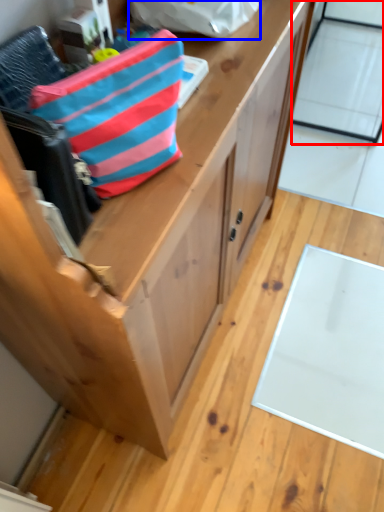
Question: Which point is closer to the camera, glass door (highlighted by a red box) or pouch (highlighted by a blue box)?

Choices:
 (A) glass door
 (B) pouch

Answer: (B)